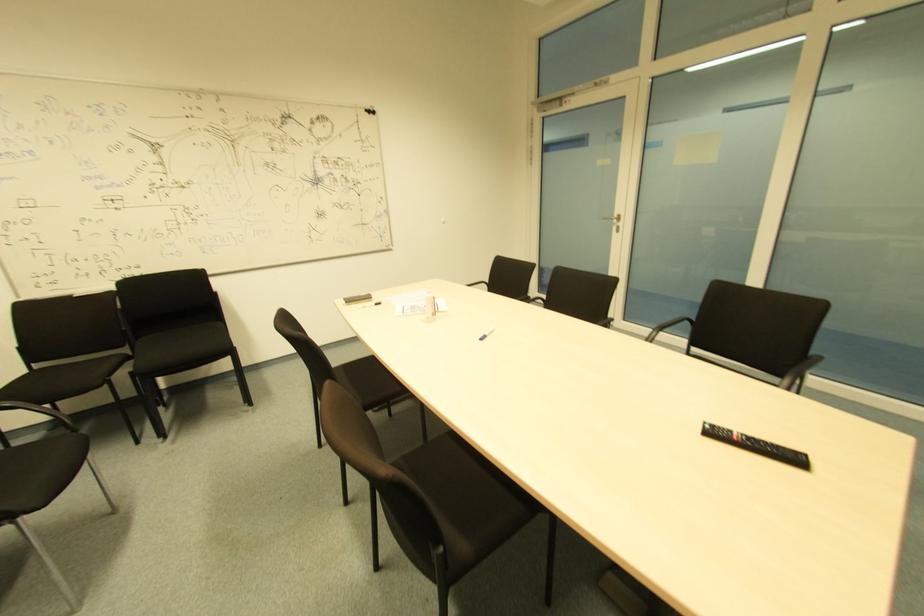
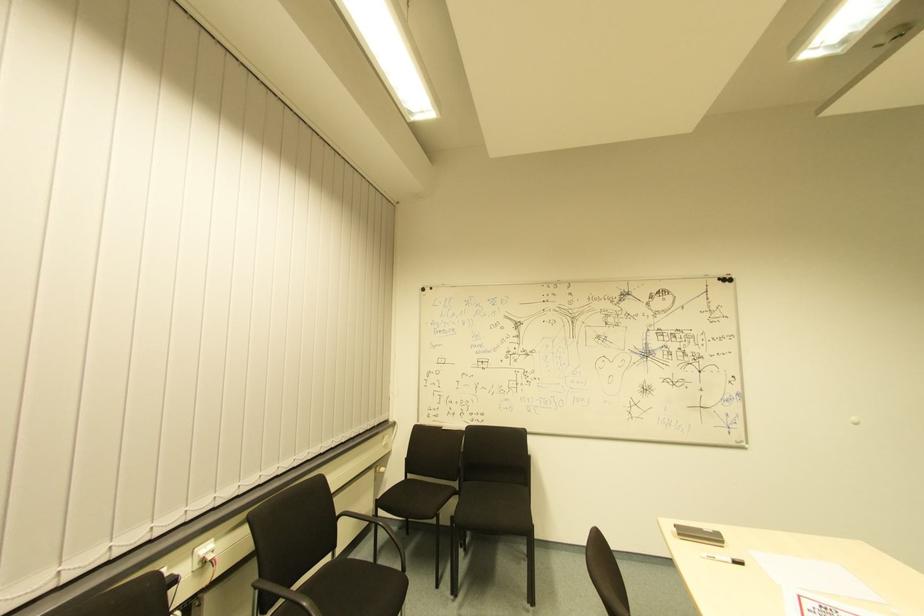
Find the pixel in the second image that matches the point at 371,119 in the first image.

(725, 286)